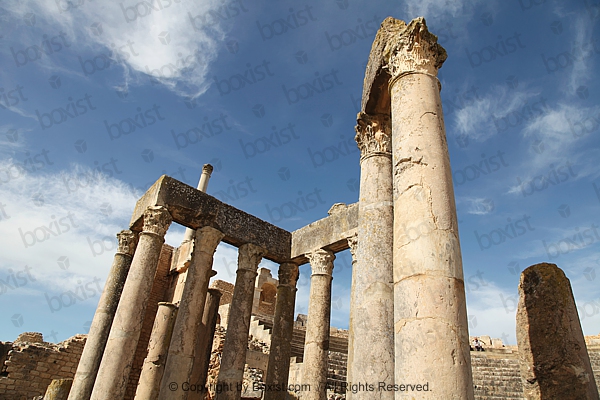
This screenshot has height=400, width=600. In order to click on pillar in this screenshot , I will do `click(277, 356)`.